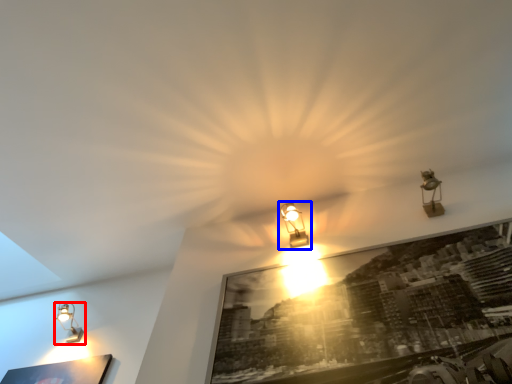
Question: Among these objects, which one is farthest to the camera, lamp (highlighted by a red box) or lamp (highlighted by a blue box)?

Choices:
 (A) lamp
 (B) lamp

Answer: (A)